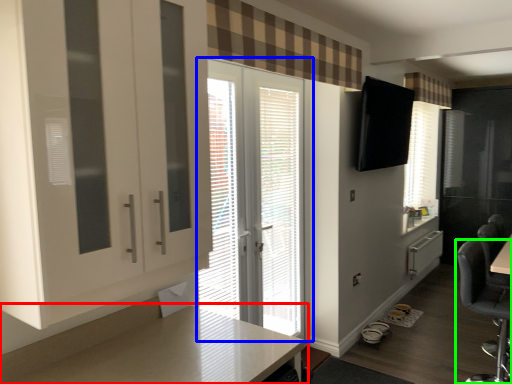
Question: Which object is the closest to the countertop (highlighted by a red box)? Choose among these: door (highlighted by a blue box) or chair (highlighted by a green box).

Choices:
 (A) door
 (B) chair

Answer: (A)